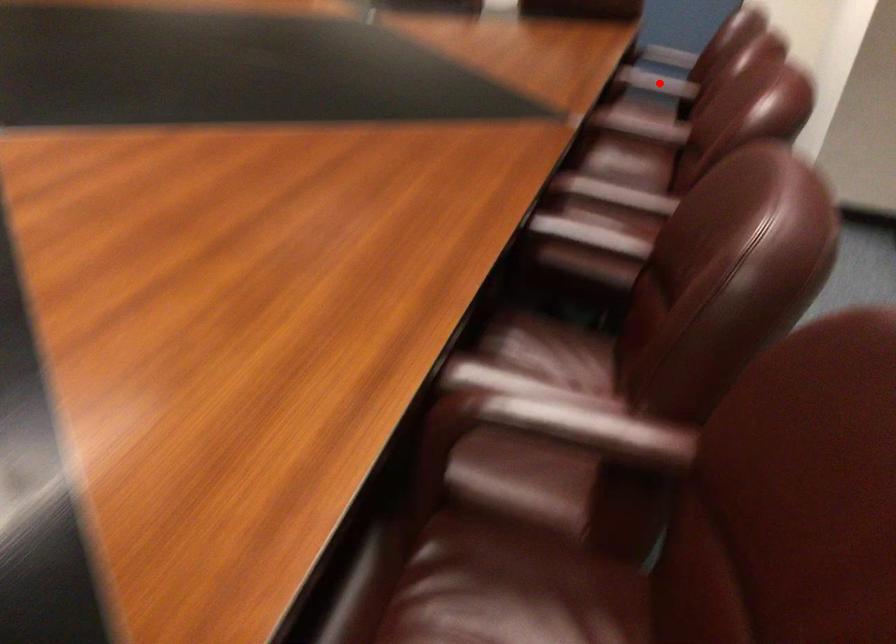
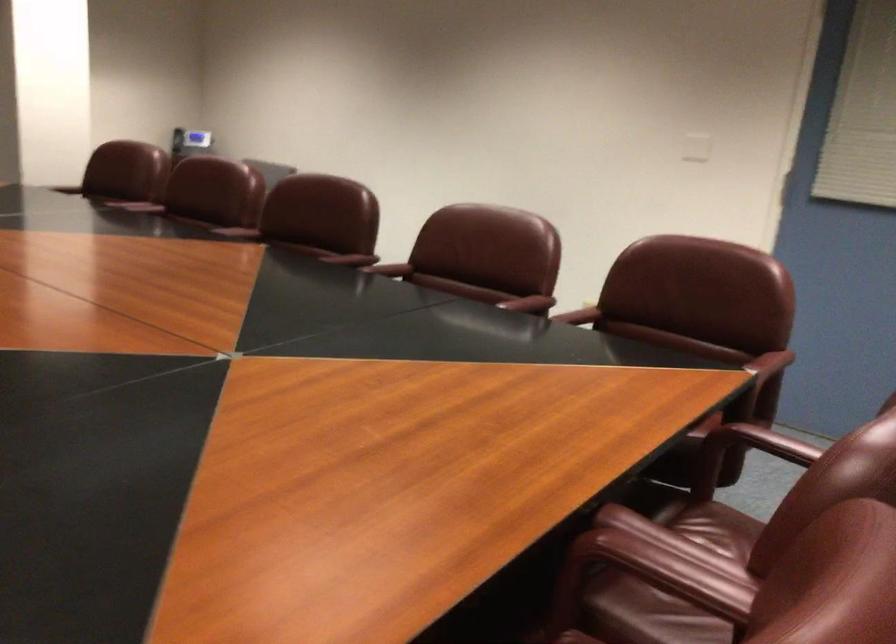
Question: I am providing you with two images of the same scene from different viewpoints. Image1 has a red point marked. In image2, the corresponding 3D location appears at what relative position? Reply with the corresponding letter.

Choices:
 (A) Closer
 (B) Farther

Answer: (A)